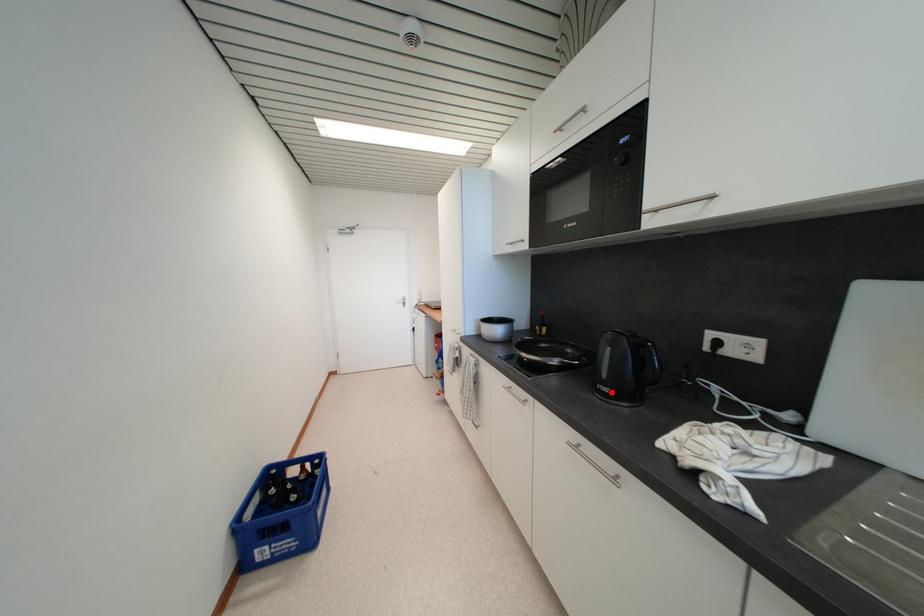
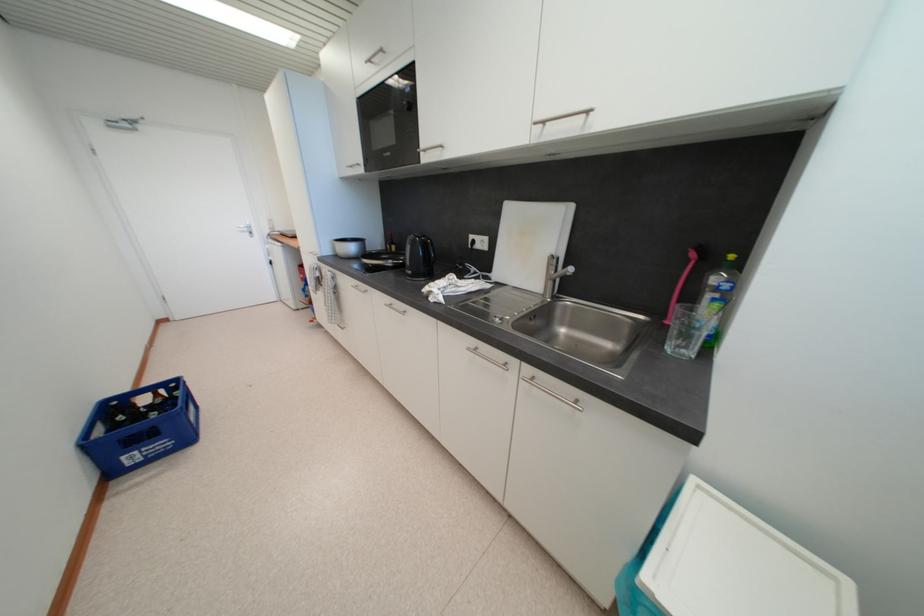
Where in the second image is the point corresponding to the highlighted location from the first image?

(415, 275)